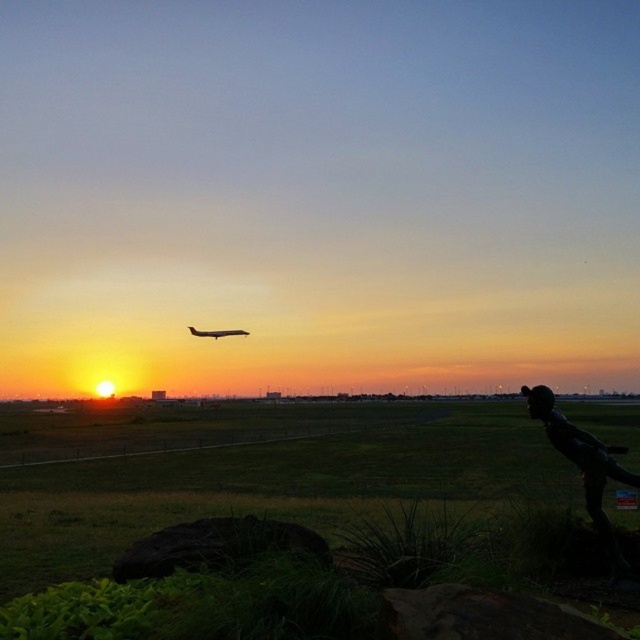
Question: Which of the following is the closest to the observer?

Choices:
 (A) metallic airplane at center
 (B) black matte statue at lower right

Answer: (B)

Question: Which point is farther to the camera?

Choices:
 (A) black matte statue at lower right
 (B) metallic airplane at center

Answer: (B)

Question: Is black matte statue at lower right to the right of metallic airplane at center from the viewer's perspective?

Choices:
 (A) yes
 (B) no

Answer: (A)

Question: Is black matte statue at lower right positioned at the back of metallic airplane at center?

Choices:
 (A) yes
 (B) no

Answer: (B)

Question: Is black matte statue at lower right below metallic airplane at center?

Choices:
 (A) no
 (B) yes

Answer: (B)